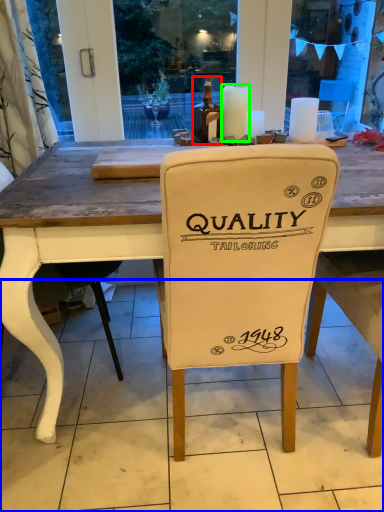
Question: Which is farther away from bottle (highlighted by a red box)? tile (highlighted by a blue box) or candle (highlighted by a green box)?

Choices:
 (A) tile
 (B) candle

Answer: (A)